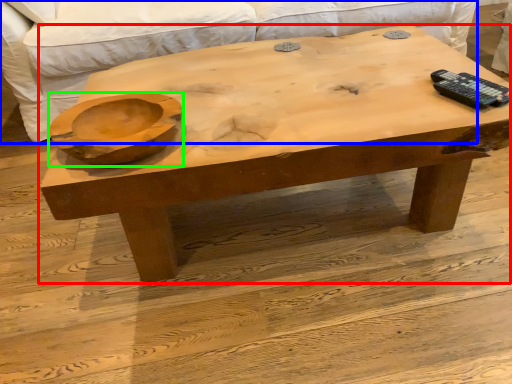
Question: Based on their relative distances, which object is farther from coffee table (highlighted by a red box)? Choose from couch (highlighted by a blue box) and bowl (highlighted by a green box).

Choices:
 (A) couch
 (B) bowl

Answer: (A)